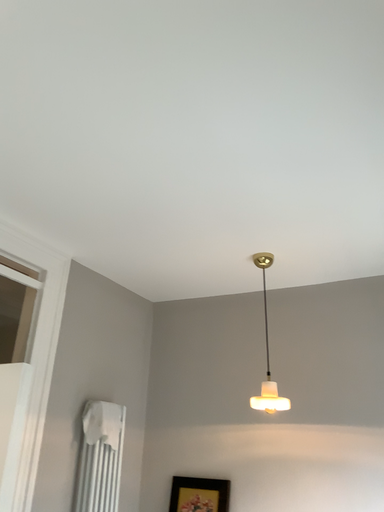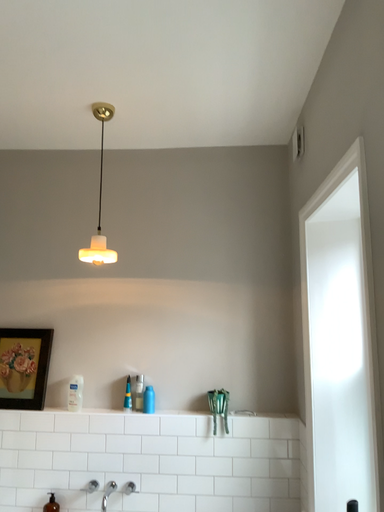
Question: How did the camera likely rotate when shooting the video?

Choices:
 (A) rotated left
 (B) rotated right

Answer: (B)